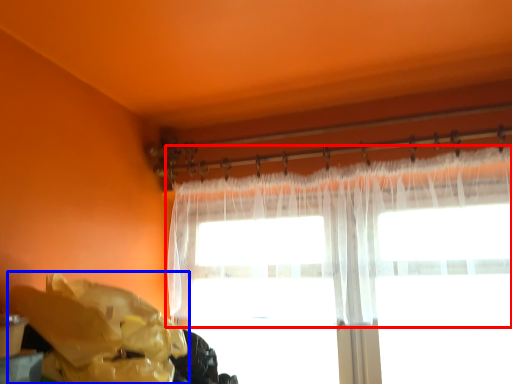
Question: Which object appears farthest to the camera in this image, curtain (highlighted by a red box) or waste (highlighted by a blue box)?

Choices:
 (A) curtain
 (B) waste

Answer: (A)